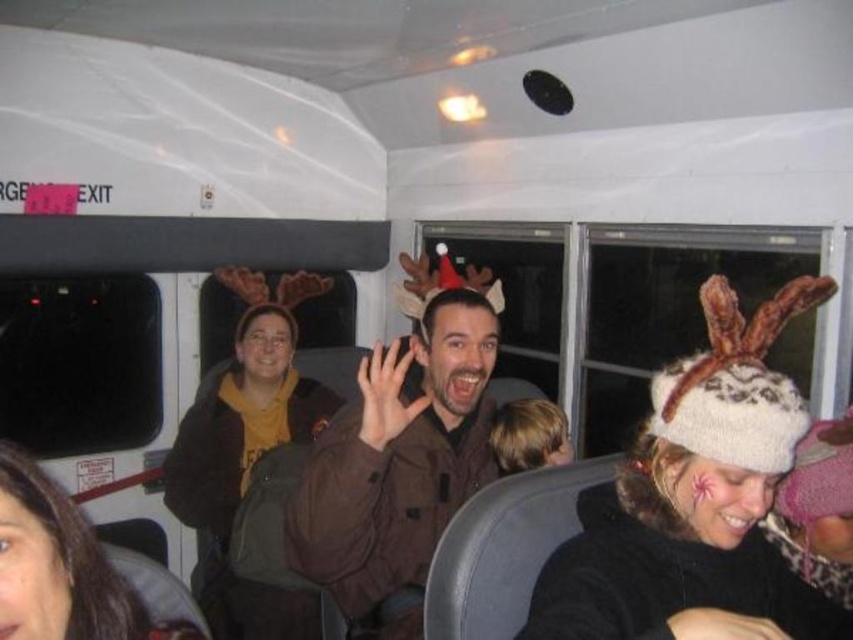
Question: Is brown matte jacket at center thinner than brown fuzzy jacket at center?

Choices:
 (A) yes
 (B) no

Answer: (A)

Question: Does brown matte jacket at center have a smaller size compared to brown fuzzy jacket at center?

Choices:
 (A) yes
 (B) no

Answer: (A)

Question: Is brown matte jacket at center positioned in front of brown fuzzy jacket at center?

Choices:
 (A) no
 (B) yes

Answer: (B)